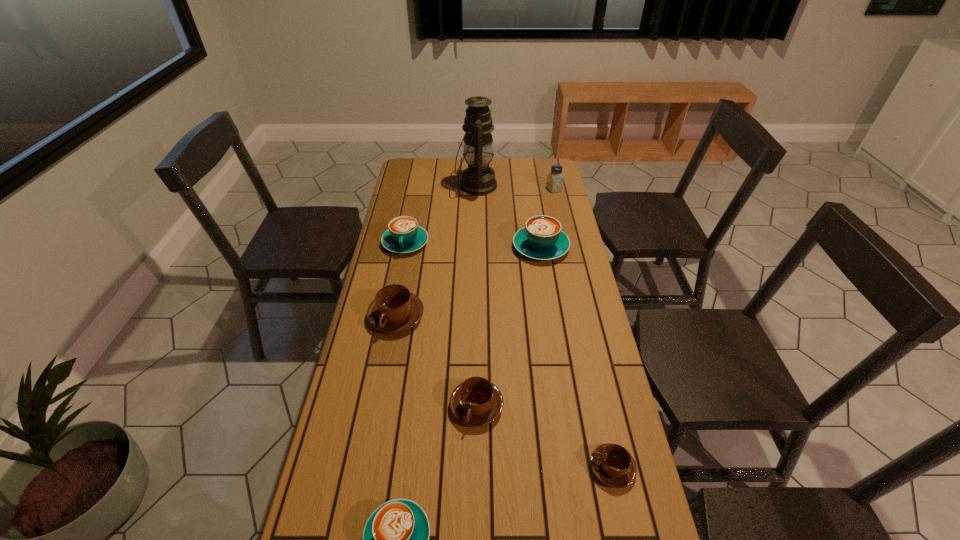
This screenshot has width=960, height=540. In order to click on free location located 0.150m on the side of the smallest brown cappuccino with the handle in this screenshot , I will do `click(528, 468)`.

Image resolution: width=960 pixels, height=540 pixels. What are the coordinates of `object that is at the far edge` in the screenshot? It's located at pos(478,179).

The image size is (960, 540). What are the coordinates of `saltshaker situated at the right edge` in the screenshot? It's located at (555, 179).

Locate an element on the screen. This screenshot has height=540, width=960. free space at the far edge is located at coordinates (450, 166).

Where is `free space at the right edge of the desktop`? The image size is (960, 540). free space at the right edge of the desktop is located at coordinates (548, 275).

What are the coordinates of `vacant space at the far left corner of the desktop` in the screenshot? It's located at (403, 168).

Where is `free space between the tallest object and the second nearest brown cappuccino`? free space between the tallest object and the second nearest brown cappuccino is located at coordinates (476, 296).

You are a GUI agent. You are given a task and a screenshot of the screen. Output one action in this format:
    pyautogui.click(x=<x>, y=<y>)
    Task: Click on the free space between the leftmost brown cappuccino and the saltshaker
    This screenshot has width=960, height=540.
    Given the screenshot: What is the action you would take?
    pyautogui.click(x=475, y=253)

This screenshot has height=540, width=960. Identify the location of free space between the shortest cappuccino and the tallest object. click(x=544, y=327).

Point out which object is positioned as the sixth nearest to the second biggest turquoise cappuccino. Please provide its 2D coordinates. Your answer should be formatted as a tuple, i.e. [(x, y)], where the tuple contains the x and y coordinates of a point satisfying the conditions above.

[(395, 539)]